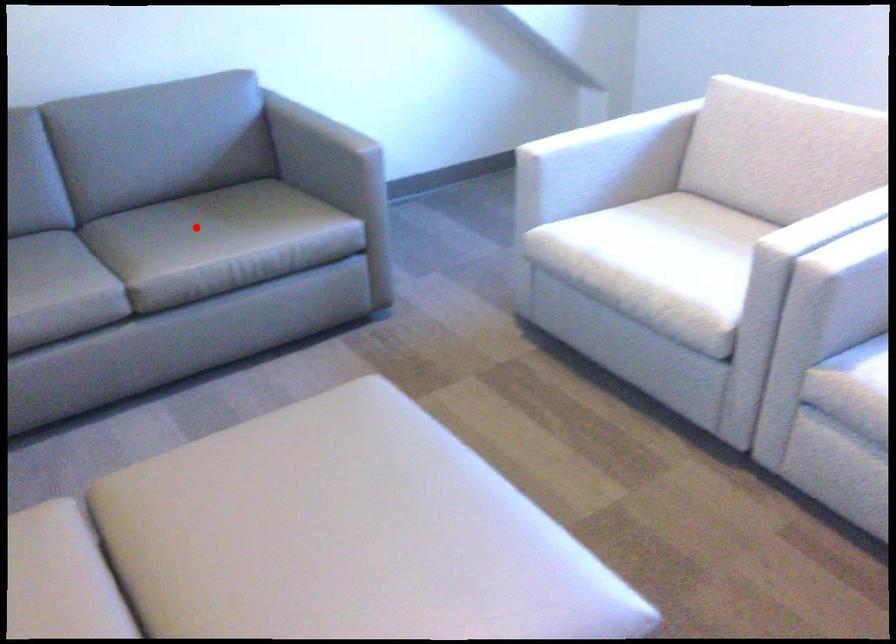
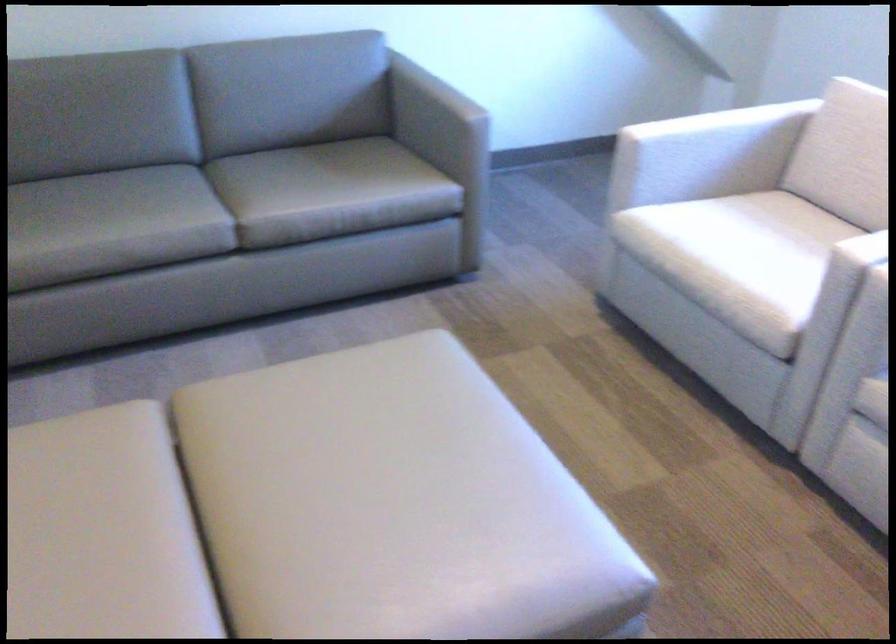
The point at the highlighted location is marked in the first image. Where is the corresponding point in the second image?

(306, 174)